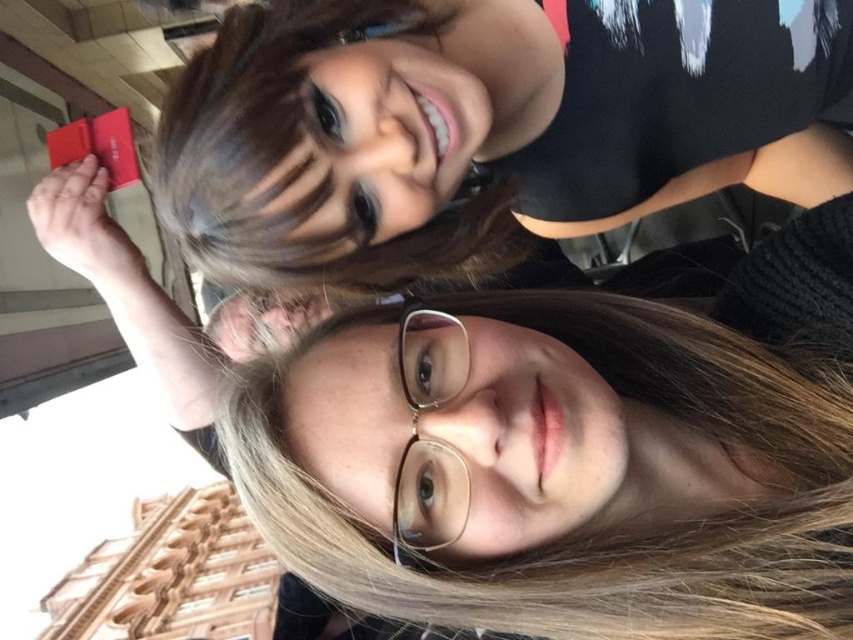
Question: Which of the following is the farthest from the observer?

Choices:
 (A) gold metallic glasses at center
 (B) matte black hair at upper center

Answer: (A)

Question: Is matte black hair at upper center further to camera compared to brown shiny hair at upper center?

Choices:
 (A) no
 (B) yes

Answer: (A)

Question: Which object is closer to the camera taking this photo?

Choices:
 (A) brown shiny hair at upper center
 (B) matte black hair at upper center
 (C) gold metallic glasses at center

Answer: (B)

Question: Can you confirm if matte black hair at upper center is positioned to the left of brown shiny hair at upper center?

Choices:
 (A) no
 (B) yes

Answer: (A)

Question: Can you confirm if matte black hair at upper center is thinner than brown shiny hair at upper center?

Choices:
 (A) no
 (B) yes

Answer: (A)

Question: Which of the following is the farthest from the observer?

Choices:
 (A) brown shiny hair at upper center
 (B) gold metallic glasses at center
 (C) matte black hair at upper center

Answer: (A)